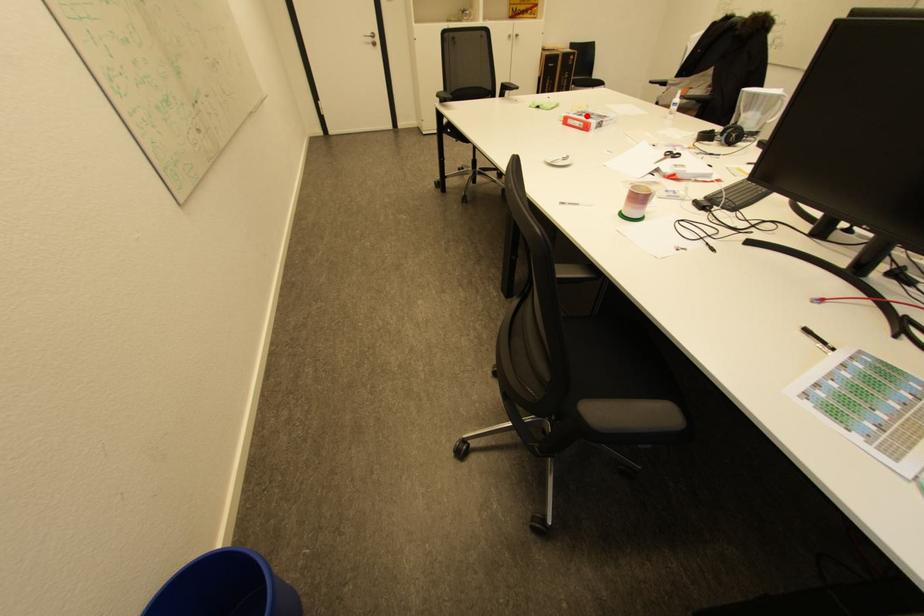
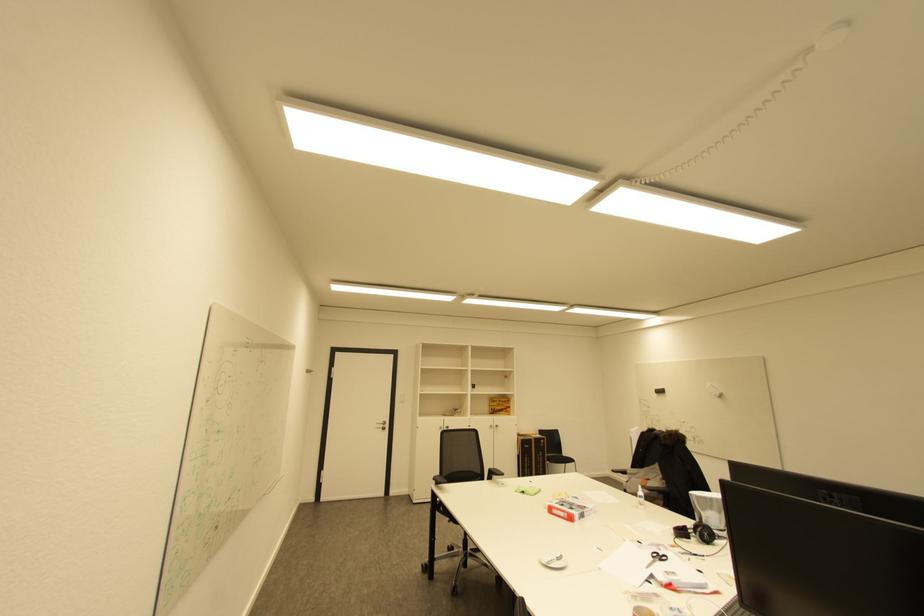
Locate, in the second image, the point that corresponds to the highlighted location in the first image.

(568, 506)